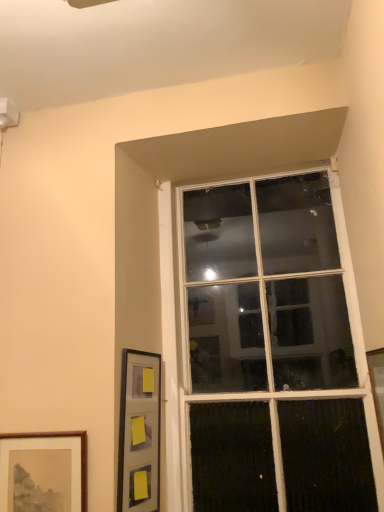
Question: Looking at their shapes, would you say brown wooden picture frame at lower left, arranged as the third picture frame when viewed from the right, is wider or thinner than clear glass window at upper center?

Choices:
 (A) thin
 (B) wide

Answer: (A)

Question: Would you say brown wooden picture frame at lower left, positioned as the first picture frame in left-to-right order, is to the left or to the right of clear glass window at upper center in the picture?

Choices:
 (A) right
 (B) left

Answer: (B)

Question: Estimate the real-world distances between objects in this image. Which object is farther from the brown wooden picture frame at lower left, arranged as the third picture frame when viewed from the right?

Choices:
 (A) matte black picture frame at lower left, the second picture frame positioned from the right
 (B) clear glass window at upper center
 (C) wooden picture frame at right, which is the 3th picture frame in left-to-right order

Answer: (C)

Question: Which is farther from the clear glass window at upper center?

Choices:
 (A) matte black picture frame at lower left, the second picture frame positioned from the right
 (B) wooden picture frame at right, placed as the first picture frame when sorted from right to left
 (C) brown wooden picture frame at lower left, arranged as the third picture frame when viewed from the right

Answer: (C)